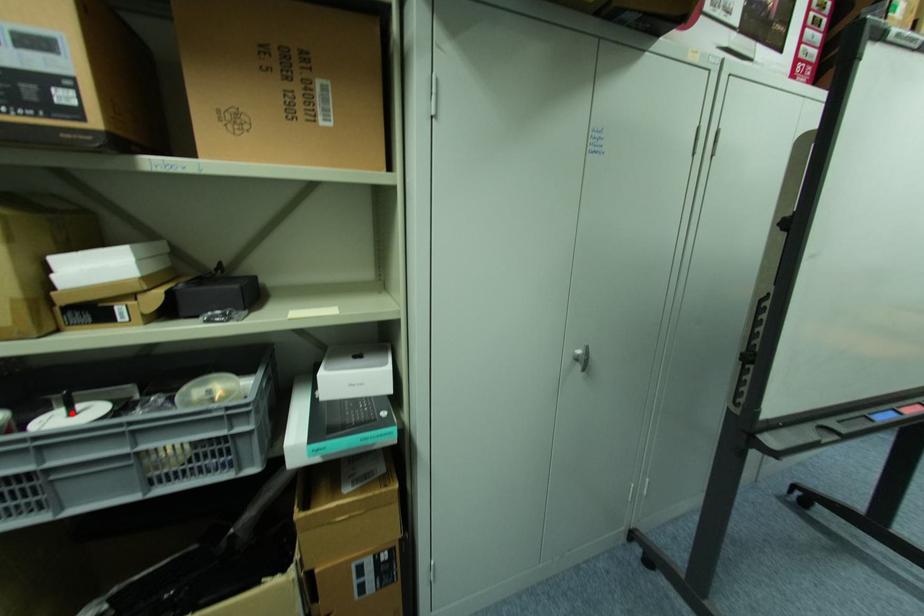
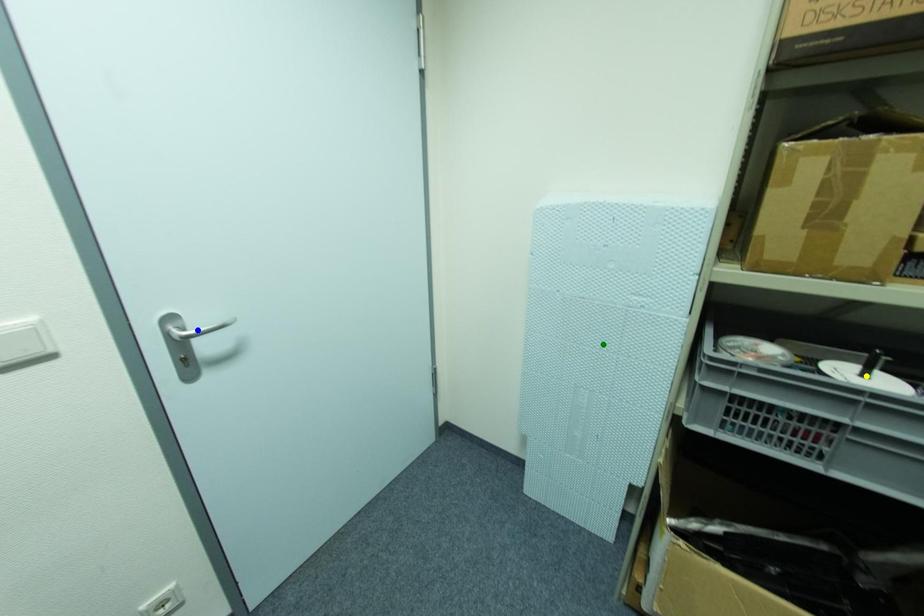
Question: I am providing you with two images of the same scene from different viewpoints. A red point is marked on the first image. You are given multiple points on the second image. In image 2, which mark is for the same physical point as the one in image 1?

Choices:
 (A) green point
 (B) yellow point
 (C) blue point

Answer: (B)